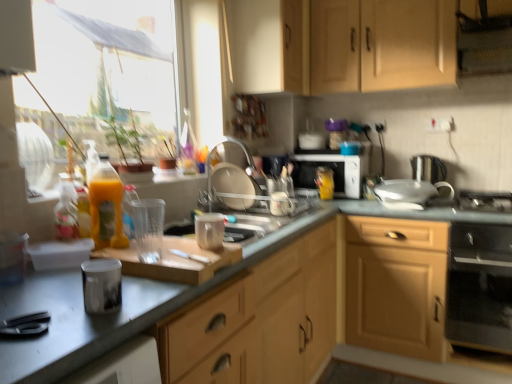
Question: From a real-world perspective, is transparent plastic glass at center, the 6th appliance positioned from the back, on clear plastic dish rack at center, the 3th appliance when ordered from left to right?

Choices:
 (A) yes
 (B) no

Answer: (B)

Question: Considering the relative sizes of transparent plastic glass at center, which ranks as the 2th appliance in left-to-right order, and clear plastic dish rack at center, which is the 5th appliance in right-to-left order, in the image provided, is transparent plastic glass at center, which ranks as the 2th appliance in left-to-right order, shorter than clear plastic dish rack at center, which is the 5th appliance in right-to-left order,?

Choices:
 (A) yes
 (B) no

Answer: (A)

Question: Is transparent plastic glass at center, marked as the sixth appliance in a right-to-left arrangement, in front of clear plastic dish rack at center, which is the 5th appliance in right-to-left order?

Choices:
 (A) no
 (B) yes

Answer: (B)

Question: Considering the relative positions of transparent plastic glass at center, marked as the sixth appliance in a right-to-left arrangement, and clear plastic dish rack at center, which is the 5th appliance in right-to-left order, in the image provided, is transparent plastic glass at center, marked as the sixth appliance in a right-to-left arrangement, behind clear plastic dish rack at center, which is the 5th appliance in right-to-left order,?

Choices:
 (A) no
 (B) yes

Answer: (A)

Question: Considering the relative sizes of transparent plastic glass at center, the 6th appliance positioned from the back, and clear plastic dish rack at center, which is the 5th appliance in right-to-left order, in the image provided, is transparent plastic glass at center, the 6th appliance positioned from the back, thinner than clear plastic dish rack at center, which is the 5th appliance in right-to-left order,?

Choices:
 (A) no
 (B) yes

Answer: (B)

Question: Looking at the image, does smooth gray countertop at center seem bigger or smaller compared to translucent yellow bottle at left?

Choices:
 (A) big
 (B) small

Answer: (A)

Question: From a real-world perspective, is smooth gray countertop at center physically located above or below translucent yellow bottle at left?

Choices:
 (A) below
 (B) above

Answer: (A)

Question: Is smooth gray countertop at center inside the boundaries of translucent yellow bottle at left, or outside?

Choices:
 (A) outside
 (B) inside

Answer: (A)

Question: Looking at their shapes, would you say smooth gray countertop at center is wider or thinner than translucent yellow bottle at left?

Choices:
 (A) thin
 (B) wide

Answer: (B)

Question: Is transparent plastic glass at center, which ranks as the 2th appliance in left-to-right order, taller or shorter than translucent yellow bottle at left?

Choices:
 (A) short
 (B) tall

Answer: (A)

Question: From the image's perspective, is transparent plastic glass at center, positioned as the 2th appliance in front-to-back order, positioned above or below translucent yellow bottle at left?

Choices:
 (A) above
 (B) below

Answer: (B)

Question: Considering their positions, is transparent plastic glass at center, the 6th appliance positioned from the back, located in front of or behind translucent yellow bottle at left?

Choices:
 (A) front
 (B) behind

Answer: (A)

Question: In terms of width, does transparent plastic glass at center, the 6th appliance positioned from the back, look wider or thinner when compared to translucent yellow bottle at left?

Choices:
 (A) thin
 (B) wide

Answer: (A)

Question: Do you think translucent yellow bottle at left is within transparent plastic glass at center, marked as the sixth appliance in a right-to-left arrangement, or outside of it?

Choices:
 (A) inside
 (B) outside

Answer: (B)

Question: Is translucent yellow bottle at left taller or shorter than transparent plastic glass at center, which ranks as the 2th appliance in left-to-right order?

Choices:
 (A) tall
 (B) short

Answer: (A)